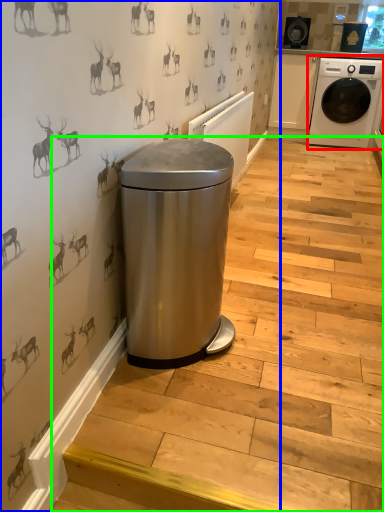
Question: Which object is positioned closest to washing machine (highlighted by a red box)? Select from backdrop (highlighted by a blue box) and stairwell (highlighted by a green box).

Choices:
 (A) backdrop
 (B) stairwell

Answer: (B)